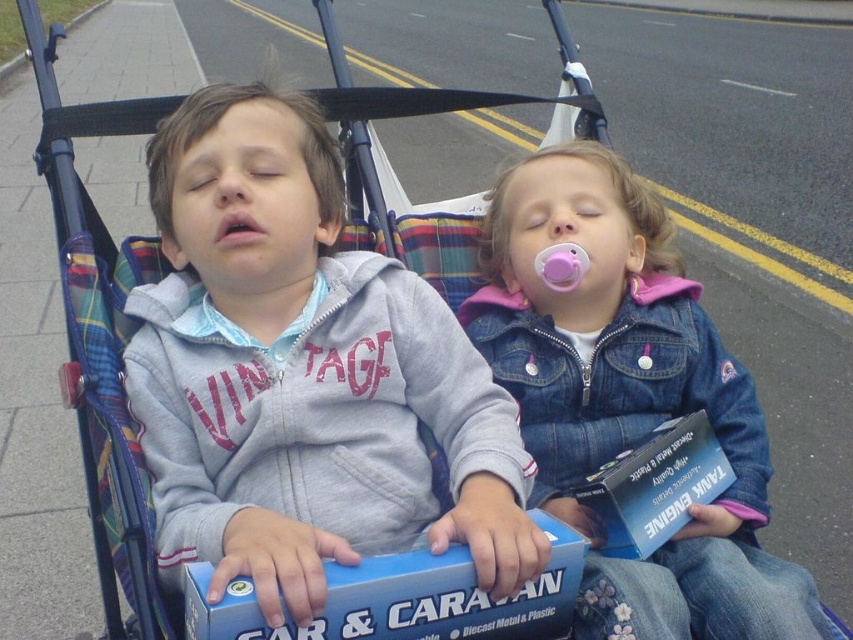
You are a photographer taking a picture of the two children in the stroller. You need to ensure that both the matte gray hoodie at center and the denim jacket at center are fully visible in the frame. Based on their widths, which clothing item requires more horizontal space in the photo to be fully captured?

The matte gray hoodie at center requires more horizontal space in the photo because its width surpasses that of the denim jacket at center.